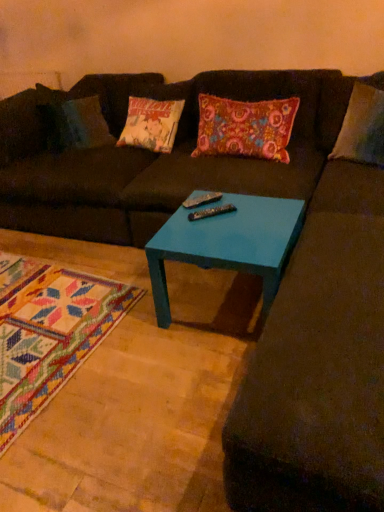
Question: Can you confirm if metallic silver remote at center, which appears as the 2th remote when viewed from the front, is wider than floral fabric pillow at center?

Choices:
 (A) yes
 (B) no

Answer: (B)

Question: From the image's perspective, is metallic silver remote at center, which appears as the 2th remote when viewed from the front, below floral fabric pillow at center?

Choices:
 (A) yes
 (B) no

Answer: (A)

Question: Is metallic silver remote at center, which appears as the 2th remote when viewed from the front, thinner than floral fabric pillow at center?

Choices:
 (A) no
 (B) yes

Answer: (B)

Question: From a real-world perspective, does metallic silver remote at center, the first remote positioned from the back, sit lower than floral fabric pillow at center?

Choices:
 (A) no
 (B) yes

Answer: (B)

Question: Considering the relative positions of metallic silver remote at center, which appears as the 2th remote when viewed from the front, and floral fabric pillow at center in the image provided, is metallic silver remote at center, which appears as the 2th remote when viewed from the front, to the right of floral fabric pillow at center from the viewer's perspective?

Choices:
 (A) no
 (B) yes

Answer: (A)

Question: From the image's perspective, would you say metallic silver remote at center, which appears as the 2th remote when viewed from the front, is positioned over floral fabric pillow at center?

Choices:
 (A) yes
 (B) no

Answer: (B)

Question: From the image's perspective, is floral fabric pillow at center above teal glossy table at center?

Choices:
 (A) no
 (B) yes

Answer: (B)

Question: Does floral fabric pillow at center have a greater width compared to teal glossy table at center?

Choices:
 (A) yes
 (B) no

Answer: (B)

Question: Does floral fabric pillow at center lie in front of teal glossy table at center?

Choices:
 (A) yes
 (B) no

Answer: (B)

Question: Does floral fabric pillow at center appear on the right side of teal glossy table at center?

Choices:
 (A) no
 (B) yes

Answer: (B)

Question: From a real-world perspective, is floral fabric pillow at center positioned under teal glossy table at center based on gravity?

Choices:
 (A) yes
 (B) no

Answer: (B)

Question: Can you confirm if floral fabric pillow at center is shorter than teal glossy table at center?

Choices:
 (A) no
 (B) yes

Answer: (A)

Question: From a real-world perspective, is teal glossy table at center over matte brown futon at center?

Choices:
 (A) yes
 (B) no

Answer: (B)